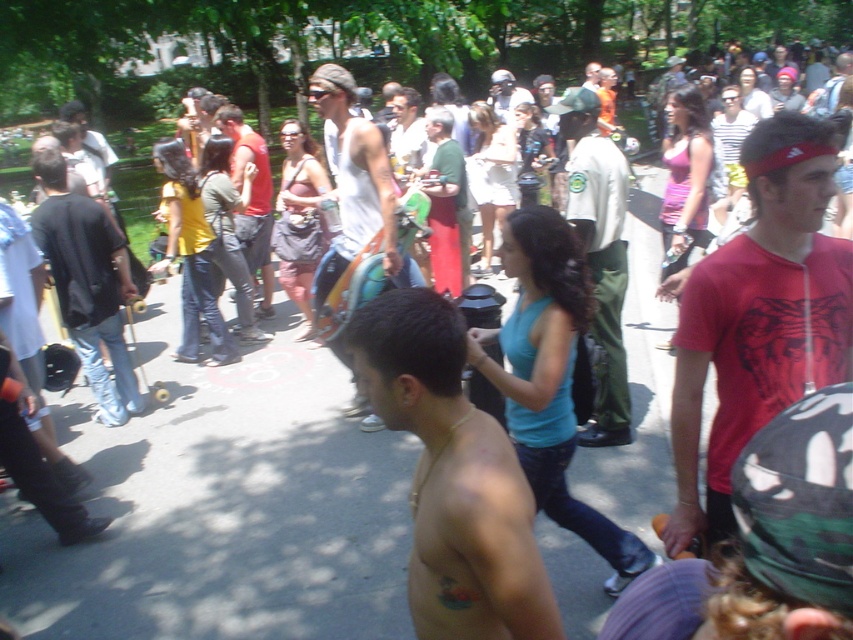
Question: Which point is closer to the camera taking this photo?

Choices:
 (A) (605, 230)
 (B) (432, 412)

Answer: (B)

Question: Which point appears closest to the camera in this image?

Choices:
 (A) (84, 212)
 (B) (413, 340)
 (C) (360, 234)
 (D) (740, 385)

Answer: (B)

Question: Where is green uniform pants at center located in relation to white tank top at center in the image?

Choices:
 (A) below
 (B) above

Answer: (A)

Question: Does red cotton t-shirt at center come behind green uniform pants at center?

Choices:
 (A) yes
 (B) no

Answer: (B)

Question: Is black cotton shirt at left above green uniform pants at center?

Choices:
 (A) yes
 (B) no

Answer: (B)

Question: Estimate the real-world distances between objects in this image. Which object is farther from the matte red tank top at center?

Choices:
 (A) green uniform pants at center
 (B) white tank top at center
 (C) shiny gold necklace at center
 (D) red cotton t-shirt at center

Answer: (C)